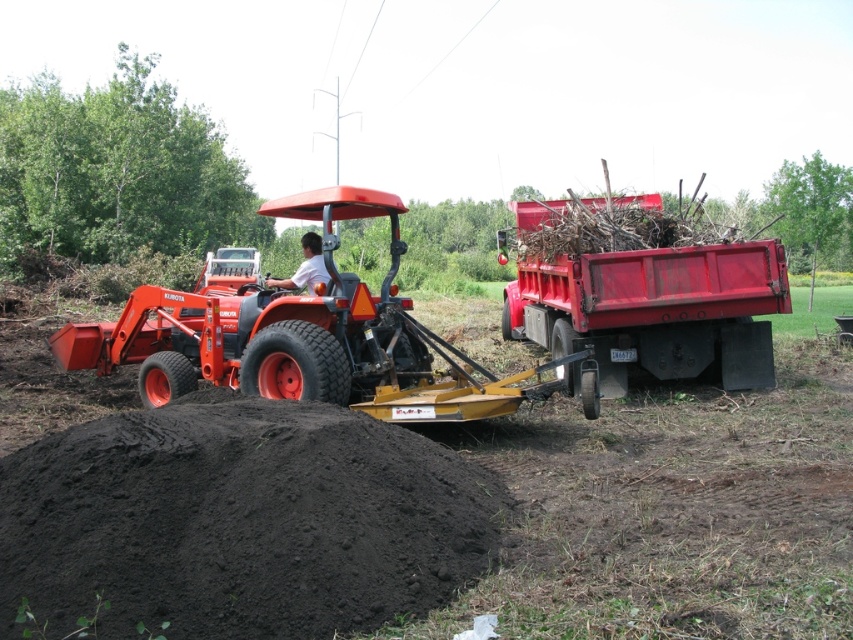
You are a farmer standing at the edge of the field. You see the black soil at lower left and the matte orange tractor at center. Which object is positioned to the right of the other?

The black soil at lower left is to the right of the matte orange tractor at center.

You are a farmer observing the scene and need to determine the relative sizes of the objects. Which object is smaller in size between the matte orange tractor at center and the white matte shirt at center?

The matte orange tractor at center has a smaller size compared to the white matte shirt at center, so the tractor is smaller.